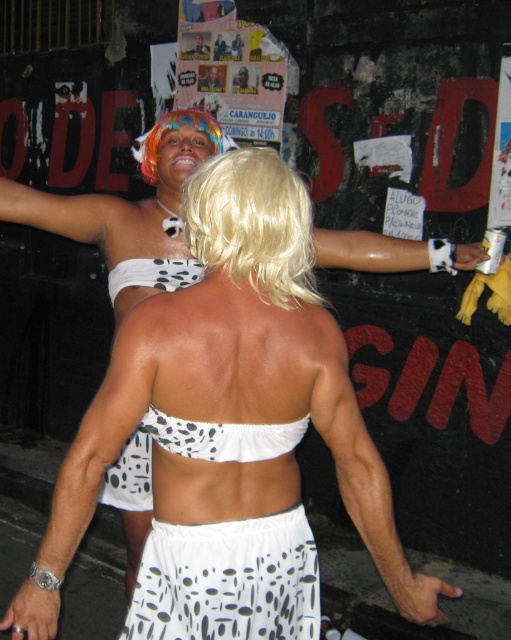
Question: Considering the real-world distances, which object is farthest from the white dotted fabric bikini top at center?

Choices:
 (A) blonde synthetic wig at upper center
 (B) white dotted fabric bikini top at back

Answer: (B)

Question: Can you confirm if blonde synthetic wig at upper center is positioned above white dotted fabric at upper center?

Choices:
 (A) yes
 (B) no

Answer: (B)

Question: Which point is closer to the camera?

Choices:
 (A) (212, 120)
 (B) (207, 90)
 (C) (204, 52)
 (D) (113, 268)

Answer: (D)

Question: Does blonde synthetic wig at upper center have a larger size compared to white dotted fabric bikini top at center?

Choices:
 (A) yes
 (B) no

Answer: (A)

Question: Which point is farther from the camera taking this photo?

Choices:
 (A) click(208, 80)
 (B) click(223, 429)
 (C) click(220, 140)
 (D) click(135, 269)

Answer: (A)

Question: Does blonde synthetic wig at upper center appear under white dotted fabric at upper center?

Choices:
 (A) no
 (B) yes

Answer: (B)